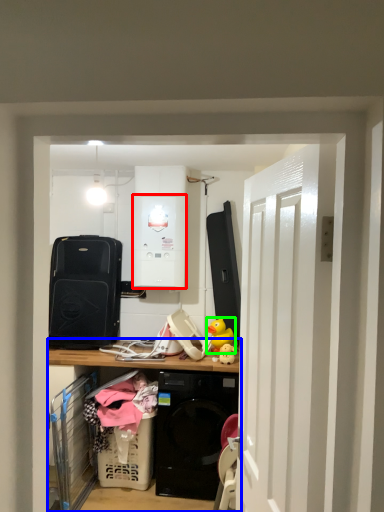
Question: Which object is positioned farthest from appliance (highlighted by a red box)? Select from cabinetry (highlighted by a blue box) and toy (highlighted by a green box).

Choices:
 (A) cabinetry
 (B) toy

Answer: (A)